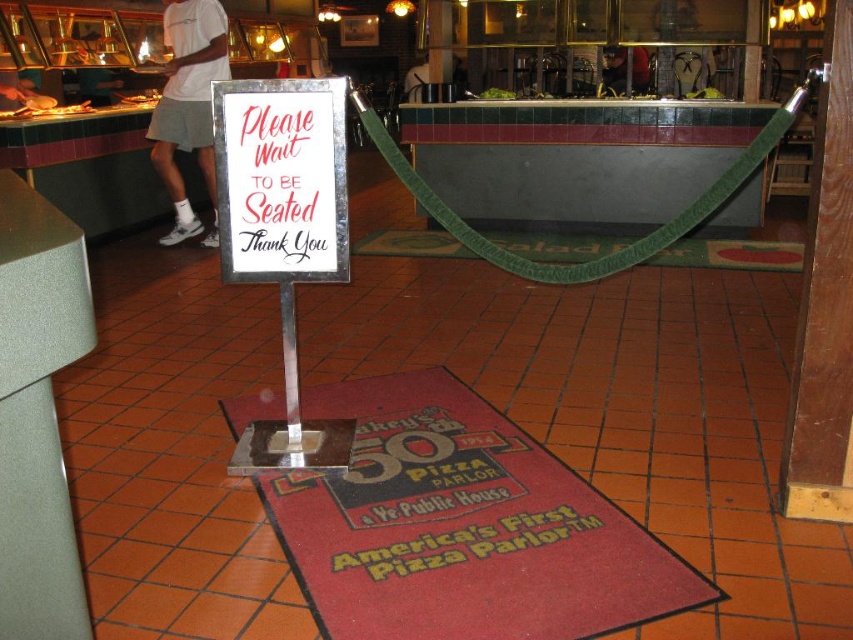
Question: Which of the following is the farthest from the observer?

Choices:
 (A) (312, 106)
 (B) (509, 524)

Answer: (A)

Question: Estimate the real-world distances between objects in this image. Which object is farther from the metallic sign at center?

Choices:
 (A) matte gray pillar at center left
 (B) green fabric rope at center
 (C) brushed metal sign at center

Answer: (B)

Question: Is matte gray pillar at center left to the right of brushed metal sign at center from the viewer's perspective?

Choices:
 (A) no
 (B) yes

Answer: (A)

Question: Which object appears farthest from the camera in this image?

Choices:
 (A) yellow matte america's first pizza parlor at center
 (B) matte gray pillar at center left

Answer: (A)

Question: Does metallic sign at center appear over brushed metal sign at center?

Choices:
 (A) no
 (B) yes

Answer: (A)

Question: Observing the image, what is the correct spatial positioning of red rubber mat at center in reference to matte gray pillar at center left?

Choices:
 (A) above
 (B) below

Answer: (B)